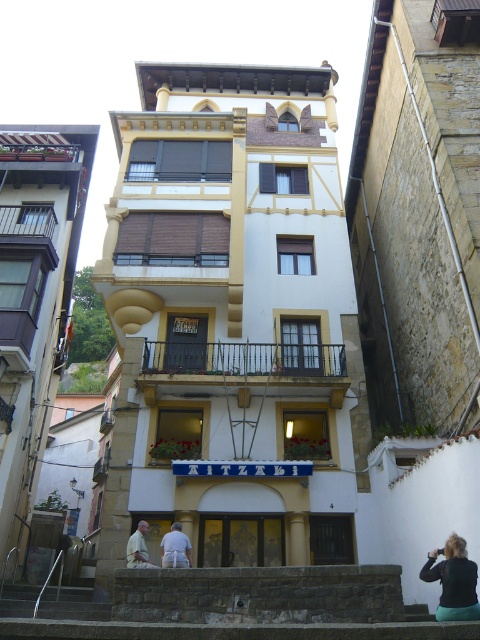
You are a customer entering the building through the arched doorway. You see a black fabric at lower right and a light brown leather jacket at center. Which item is closer to the entrance?

The black fabric at lower right is closer to the entrance because it is in front of the light brown leather jacket at center.